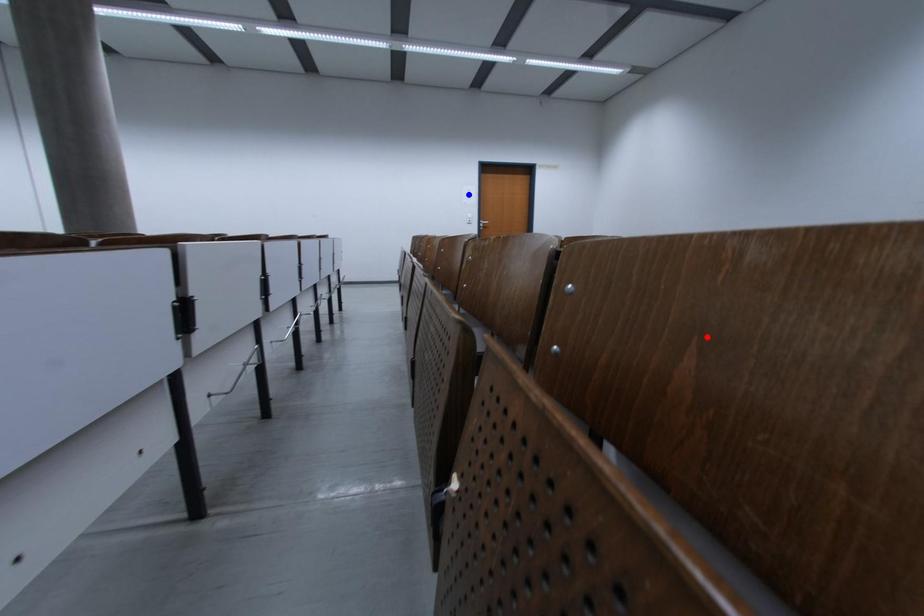
Question: Which of the two points in the image is closer to the camera?

Choices:
 (A) Blue point is closer.
 (B) Red point is closer.

Answer: (B)